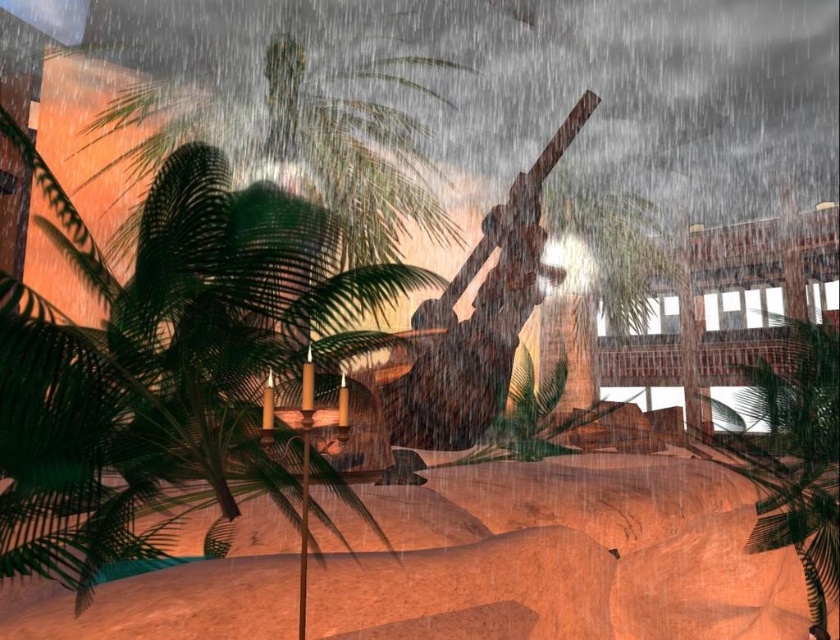
Does green leafy palm tree at right lie in front of green leafy palm tree at center?

Yes, green leafy palm tree at right is in front of green leafy palm tree at center.

Does green leafy palm tree at right appear under green leafy palm tree at center?

Yes, green leafy palm tree at right is below green leafy palm tree at center.

Identify the location of green leafy palm tree at right. The height and width of the screenshot is (640, 840). (798, 456).